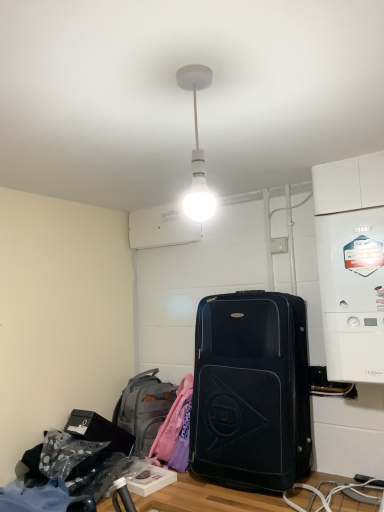
Question: Is the position of white matte bulb at center more distant than that of white plastic boiler at right?

Choices:
 (A) yes
 (B) no

Answer: (B)

Question: Does white matte bulb at center have a larger size compared to white plastic boiler at right?

Choices:
 (A) no
 (B) yes

Answer: (A)

Question: Considering the relative sizes of white matte bulb at center and white plastic boiler at right in the image provided, is white matte bulb at center thinner than white plastic boiler at right?

Choices:
 (A) no
 (B) yes

Answer: (B)

Question: Is white matte bulb at center aimed at white plastic boiler at right?

Choices:
 (A) no
 (B) yes

Answer: (A)

Question: From the image's perspective, is white matte bulb at center on white plastic boiler at right?

Choices:
 (A) no
 (B) yes

Answer: (B)

Question: Is white matte bulb at center to the right of white plastic boiler at right from the viewer's perspective?

Choices:
 (A) no
 (B) yes

Answer: (A)

Question: Is gray fabric backpack at lower left wider than white matte bulb at center?

Choices:
 (A) yes
 (B) no

Answer: (A)

Question: Does gray fabric backpack at lower left have a lesser height compared to white matte bulb at center?

Choices:
 (A) no
 (B) yes

Answer: (A)

Question: Is gray fabric backpack at lower left facing away from white matte bulb at center?

Choices:
 (A) yes
 (B) no

Answer: (B)

Question: Is gray fabric backpack at lower left facing towards white matte bulb at center?

Choices:
 (A) no
 (B) yes

Answer: (A)

Question: Is gray fabric backpack at lower left taller than white matte bulb at center?

Choices:
 (A) no
 (B) yes

Answer: (B)

Question: Can you confirm if gray fabric backpack at lower left is positioned to the left of white matte bulb at center?

Choices:
 (A) yes
 (B) no

Answer: (A)

Question: Considering the relative sizes of white plastic boiler at right and white matte bulb at center in the image provided, is white plastic boiler at right thinner than white matte bulb at center?

Choices:
 (A) no
 (B) yes

Answer: (A)